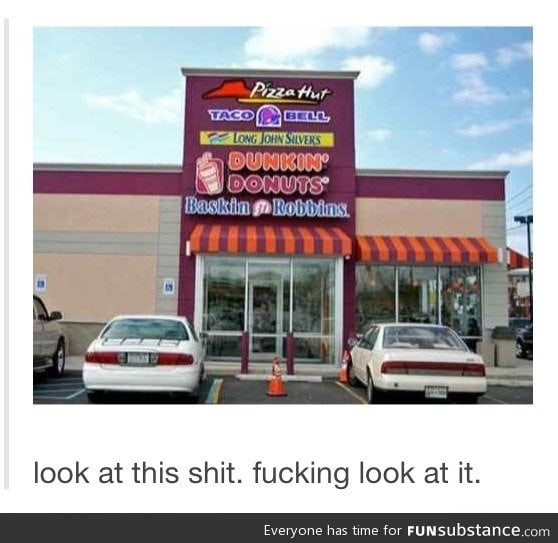
Where is `light`? This screenshot has height=543, width=558. light is located at coordinates (524, 217).